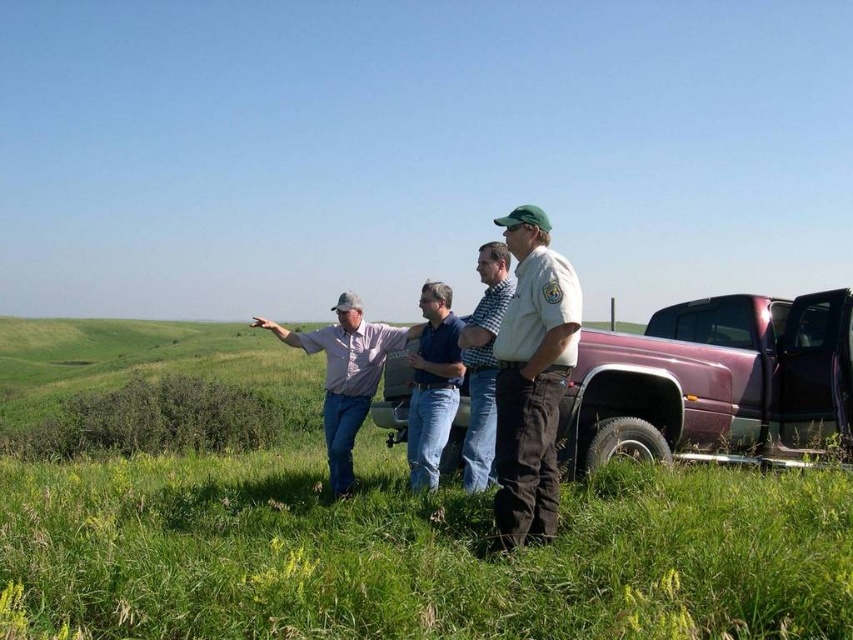
Looking at this image, can you confirm if pink metallic truck at center is shorter than white uniform at center?

Correct, pink metallic truck at center is not as tall as white uniform at center.

Between point (598, 442) and point (547, 339), which one is positioned in front?

Point (547, 339) is in front.

Is point (670, 417) farther from camera compared to point (548, 314)?

Yes, it is behind point (548, 314).

The image size is (853, 640). Find the location of `pink metallic truck at center`. pink metallic truck at center is located at coordinates (714, 384).

Which is above, green grassy at lower center or pink metallic truck at center?

pink metallic truck at center is above.

Does green grassy at lower center appear under pink metallic truck at center?

Indeed, green grassy at lower center is positioned under pink metallic truck at center.

Which is in front, point (624, 508) or point (398, 435)?

Point (624, 508) is more forward.

Find the location of a particular element. green grassy at lower center is located at coordinates (422, 554).

Between green grassy at lower center and light brown shirt at center, which one is positioned lower?

Positioned lower is green grassy at lower center.

Between green grassy at lower center and light brown shirt at center, which one has more height?

Standing taller between the two is light brown shirt at center.

Image resolution: width=853 pixels, height=640 pixels. Identify the location of green grassy at lower center. (422, 554).

Where is `green grassy at lower center`? green grassy at lower center is located at coordinates (422, 554).